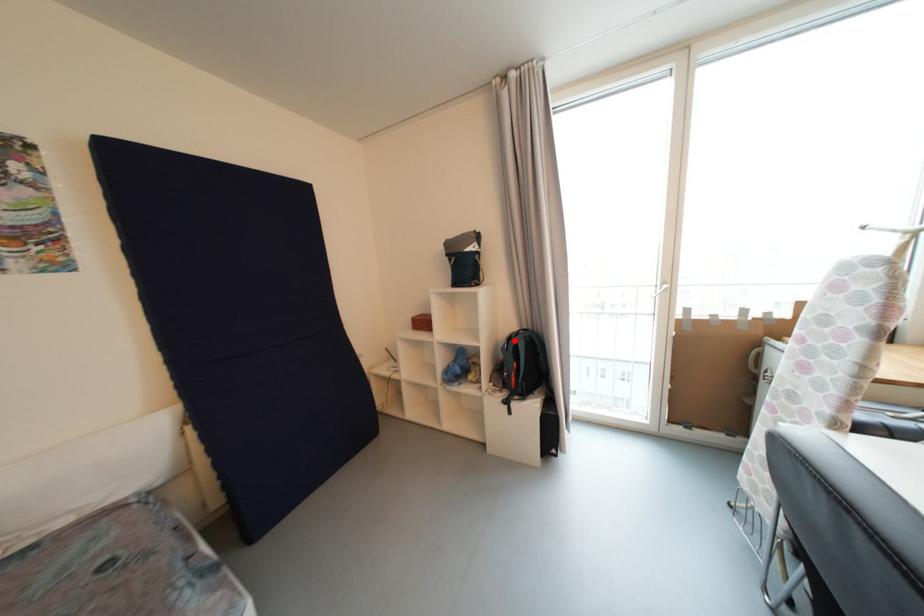
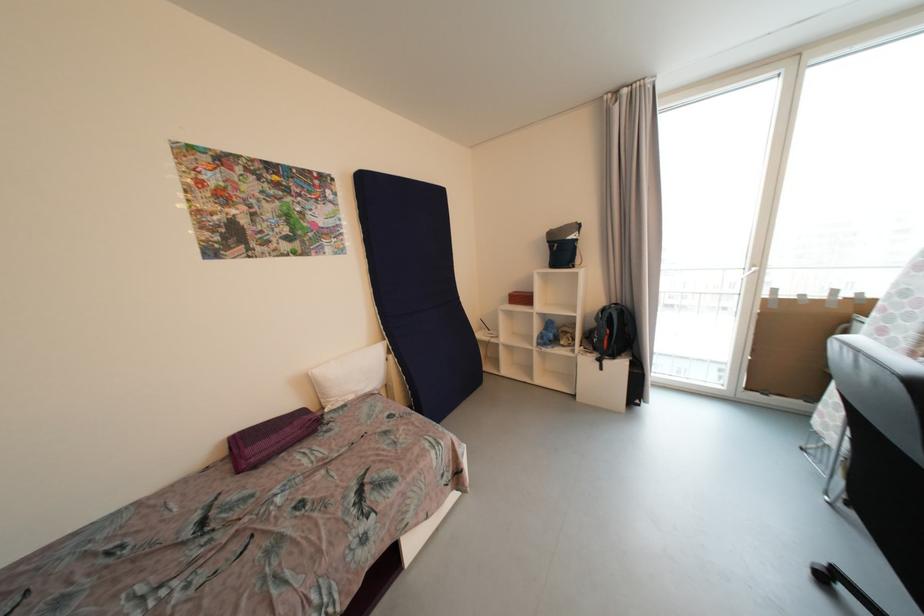
Find the pixel in the second image that matches the highlighted location in the first image.

(608, 312)